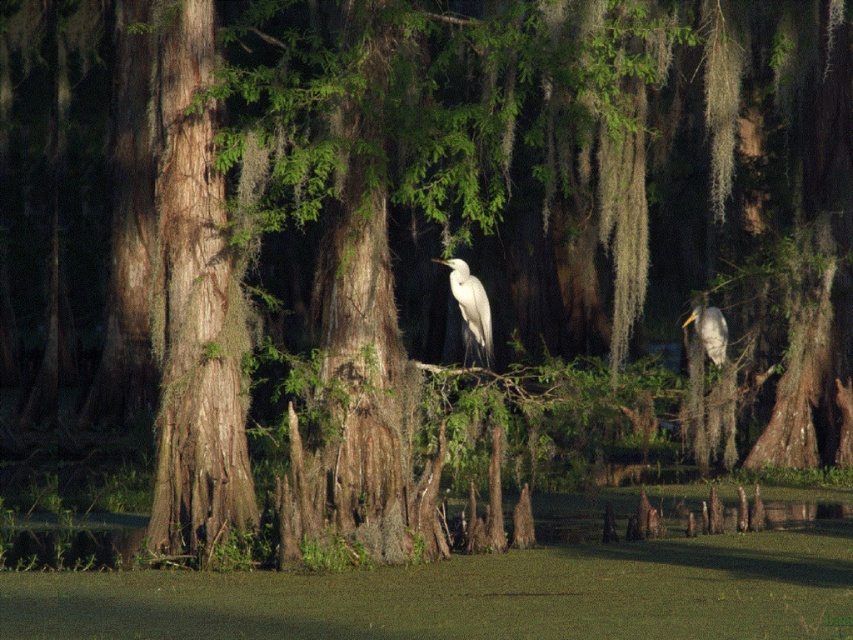
Question: Which object is farther from the camera taking this photo?

Choices:
 (A) white smooth bird at center
 (B) white matte bird at right

Answer: (B)

Question: Can you confirm if white smooth bird at center is bigger than white matte bird at right?

Choices:
 (A) yes
 (B) no

Answer: (A)

Question: Which point is farther to the camera?

Choices:
 (A) (722, 348)
 (B) (456, 268)

Answer: (A)

Question: Which of the following is the farthest from the observer?

Choices:
 (A) white matte bird at right
 (B) white smooth bird at center

Answer: (A)

Question: Can you confirm if white smooth bird at center is bigger than white matte bird at right?

Choices:
 (A) no
 (B) yes

Answer: (B)

Question: Does white smooth bird at center appear under white matte bird at right?

Choices:
 (A) yes
 (B) no

Answer: (B)